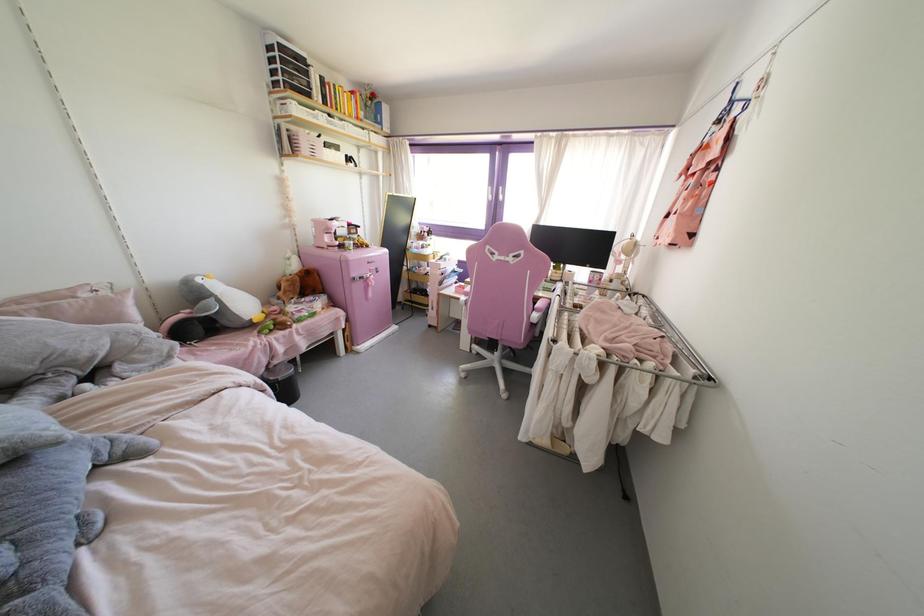
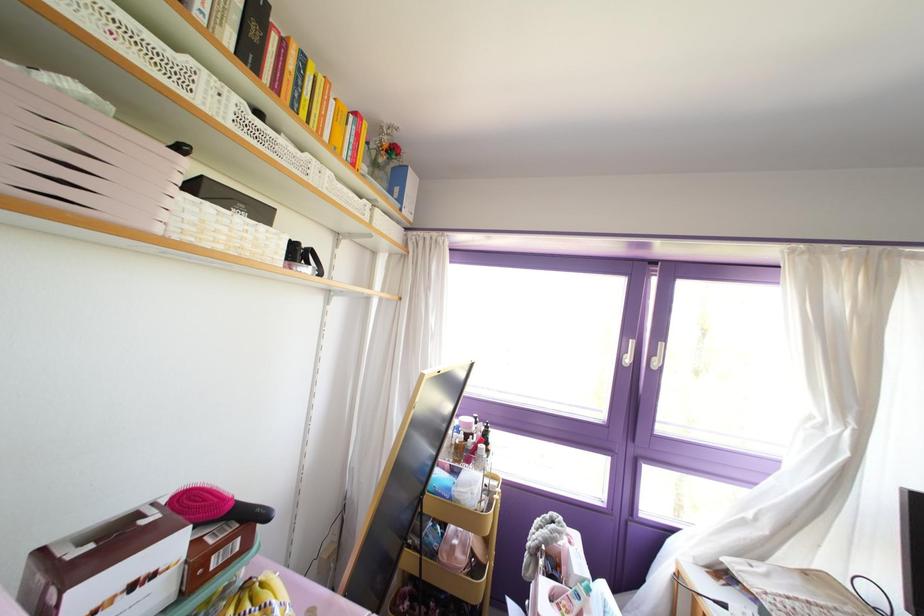
Where in the second image is the point corresponding to point (365, 105) from the first image?

(372, 163)